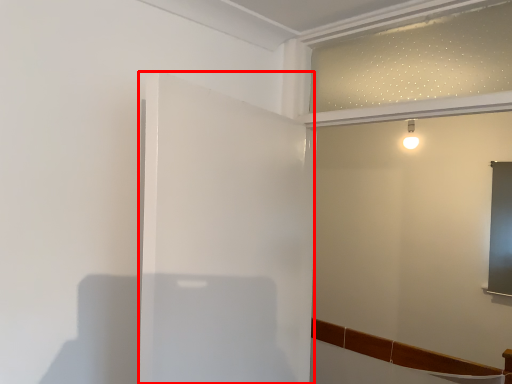
Question: Where is screen door (annotated by the red box) located in relation to backdrop in the image?

Choices:
 (A) left
 (B) right

Answer: (A)